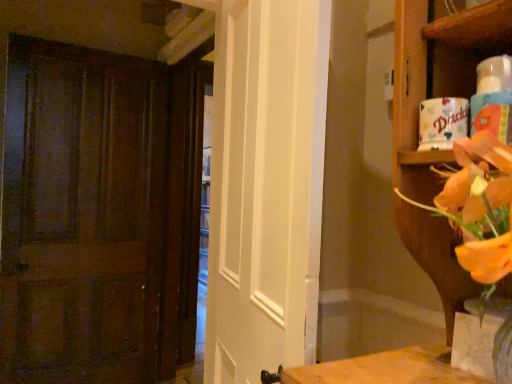
Describe the element at coordinates (81, 215) in the screenshot. I see `wooden door at left` at that location.

What do you see at coordinates (478, 336) in the screenshot?
I see `translucent glass vase at lower right` at bounding box center [478, 336].

At what (x,y) coordinates should I click in order to perform the action: click on wooden shelf at upper right. Please return your answer as a coordinate pair (x, y). The image size is (512, 384). Looking at the image, I should click on (474, 26).

Do you think white glossy door at center is within wooden shelf at upper right, or outside of it?

white glossy door at center lies outside wooden shelf at upper right.

From a real-world perspective, is white glossy door at center under wooden shelf at upper right?

Yes, from a real-world perspective, white glossy door at center is beneath wooden shelf at upper right.

Considering the sizes of objects white glossy door at center and wooden shelf at upper right in the image provided, who is wider, white glossy door at center or wooden shelf at upper right?

Wider between the two is wooden shelf at upper right.

Is point (230, 276) positioned behind point (469, 16)?

Yes.

Is translucent glass vase at lower right oriented towards wooden shelf at upper right?

No, translucent glass vase at lower right does not turn towards wooden shelf at upper right.

You are a GUI agent. You are given a task and a screenshot of the screen. Output one action in this format:
    pyautogui.click(x=<x>, y=<y>)
    Task: Click on the vase below the wooden shelf at upper right (from a real-world perspective)
    The image size is (512, 384).
    Given the screenshot: What is the action you would take?
    pyautogui.click(x=478, y=336)

Which is more to the right, translucent glass vase at lower right or wooden shelf at upper right?

From the viewer's perspective, wooden shelf at upper right appears more on the right side.

Which of these two, translucent glass vase at lower right or wooden shelf at upper right, is bigger?

wooden shelf at upper right.

Is wooden door at left bigger than white glossy door at center?

No.

Looking at this image, is wooden door at left far away from white glossy door at center?

Yes, wooden door at left and white glossy door at center are quite far apart.

From the picture: Is wooden door at left oriented towards white glossy door at center?

Yes.

From a real-world perspective, which is physically above, wooden door at left or white glossy door at center?

In real-world perspective, white glossy door at center is above.

Is point (471, 28) farther from viewer compared to point (475, 343)?

That is True.

Which object is thinner, wooden shelf at upper right or translucent glass vase at lower right?

Thinner between the two is translucent glass vase at lower right.

Measure the distance from wooden shelf at upper right to translucent glass vase at lower right.

The distance of wooden shelf at upper right from translucent glass vase at lower right is 21.18 inches.

Which object is positioned more to the left, wooden shelf at upper right or translucent glass vase at lower right?

translucent glass vase at lower right is more to the left.

Is translucent glass vase at lower right located within wooden door at left?

Actually, translucent glass vase at lower right is outside wooden door at left.

Is wooden door at left looking in the opposite direction of translucent glass vase at lower right?

wooden door at left is not turned away from translucent glass vase at lower right.

How far apart are wooden door at left and translucent glass vase at lower right?

wooden door at left and translucent glass vase at lower right are 7.54 feet apart from each other.

Does white glossy door at center come in front of translucent glass vase at lower right?

No, white glossy door at center is behind translucent glass vase at lower right.

Measure the distance between white glossy door at center and translucent glass vase at lower right.

The distance of white glossy door at center from translucent glass vase at lower right is 31.23 inches.

Considering the sizes of objects white glossy door at center and translucent glass vase at lower right in the image provided, who is wider, white glossy door at center or translucent glass vase at lower right?

Wider between the two is white glossy door at center.

Locate an element on the screen. screen door above the translucent glass vase at lower right (from the image's perspective) is located at coordinates (266, 185).

Considering the sizes of objects translucent glass vase at lower right and wooden door at left in the image provided, who is bigger, translucent glass vase at lower right or wooden door at left?

wooden door at left.

Identify the location of door behind the translucent glass vase at lower right. This screenshot has width=512, height=384. (81, 215).

From the image's perspective, is translucent glass vase at lower right on wooden door at left?

No, from the image's perspective, translucent glass vase at lower right is not over wooden door at left.

Could you tell me if translucent glass vase at lower right is facing wooden door at left?

No, translucent glass vase at lower right is not aimed at wooden door at left.

In order to click on shelf to the right of white glossy door at center in this screenshot , I will do `click(474, 26)`.

The image size is (512, 384). What are the coordinates of `shelf above the translucent glass vase at lower right (from a real-world perspective)` in the screenshot? It's located at (474, 26).

Consider the image. Based on their spatial positions, is wooden door at left or translucent glass vase at lower right further from wooden shelf at upper right?

wooden door at left is further to wooden shelf at upper right.

Considering their positions, is translucent glass vase at lower right positioned closer to white glossy door at center than wooden door at left?

translucent glass vase at lower right lies closer to white glossy door at center than the other object.

Looking at the image, which one is located closer to wooden door at left, wooden shelf at upper right or white glossy door at center?

white glossy door at center is closer to wooden door at left.

Estimate the real-world distances between objects in this image. Which object is closer to wooden shelf at upper right, translucent glass vase at lower right or wooden door at left?

Based on the image, translucent glass vase at lower right appears to be nearer to wooden shelf at upper right.

When comparing their distances from translucent glass vase at lower right, does wooden door at left or white glossy door at center seem further?

Among the two, wooden door at left is located further to translucent glass vase at lower right.

Which object lies further to the anchor point wooden shelf at upper right, translucent glass vase at lower right or white glossy door at center?

The object further to wooden shelf at upper right is white glossy door at center.

Based on their spatial positions, is wooden door at left or wooden shelf at upper right further from translucent glass vase at lower right?

wooden door at left is positioned further to the anchor translucent glass vase at lower right.

Based on their spatial positions, is white glossy door at center or wooden door at left further from wooden shelf at upper right?

wooden door at left lies further to wooden shelf at upper right than the other object.

You are a GUI agent. You are given a task and a screenshot of the screen. Output one action in this format:
    pyautogui.click(x=<x>, y=<y>)
    Task: Click on the screen door positioned between wooden shelf at upper right and wooden door at left from near to far
    This screenshot has width=512, height=384.
    Given the screenshot: What is the action you would take?
    pyautogui.click(x=266, y=185)

Locate an element on the screen. The height and width of the screenshot is (384, 512). screen door between translucent glass vase at lower right and wooden door at left from front to back is located at coordinates (266, 185).

This screenshot has height=384, width=512. I want to click on vase between wooden shelf at upper right and wooden door at left in the front-back direction, so click(478, 336).

Locate an element on the screen. This screenshot has height=384, width=512. screen door between wooden shelf at upper right and translucent glass vase at lower right in the up-down direction is located at coordinates (266, 185).